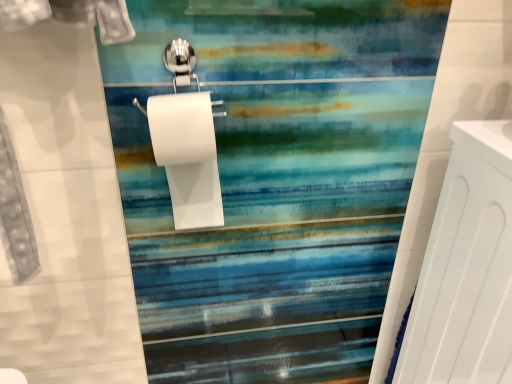
Question: Considering the positions of white matte toilet paper at center and white matte radiator at right in the image, is white matte toilet paper at center wider or thinner than white matte radiator at right?

Choices:
 (A) wide
 (B) thin

Answer: (B)

Question: Considering the positions of point (153, 147) and point (459, 241), is point (153, 147) closer or farther from the camera than point (459, 241)?

Choices:
 (A) farther
 (B) closer

Answer: (B)

Question: In the image, is white matte toilet paper at center on the left side or the right side of white matte radiator at right?

Choices:
 (A) right
 (B) left

Answer: (B)

Question: Would you say white matte radiator at right is inside or outside white matte toilet paper at center?

Choices:
 (A) inside
 (B) outside

Answer: (B)

Question: From the image's perspective, is white matte radiator at right located above or below white matte toilet paper at center?

Choices:
 (A) above
 (B) below

Answer: (B)

Question: From a real-world perspective, is white matte radiator at right above or below white matte toilet paper at center?

Choices:
 (A) above
 (B) below

Answer: (B)

Question: Considering the positions of white matte radiator at right and white matte toilet paper at center in the image, is white matte radiator at right wider or thinner than white matte toilet paper at center?

Choices:
 (A) thin
 (B) wide

Answer: (B)